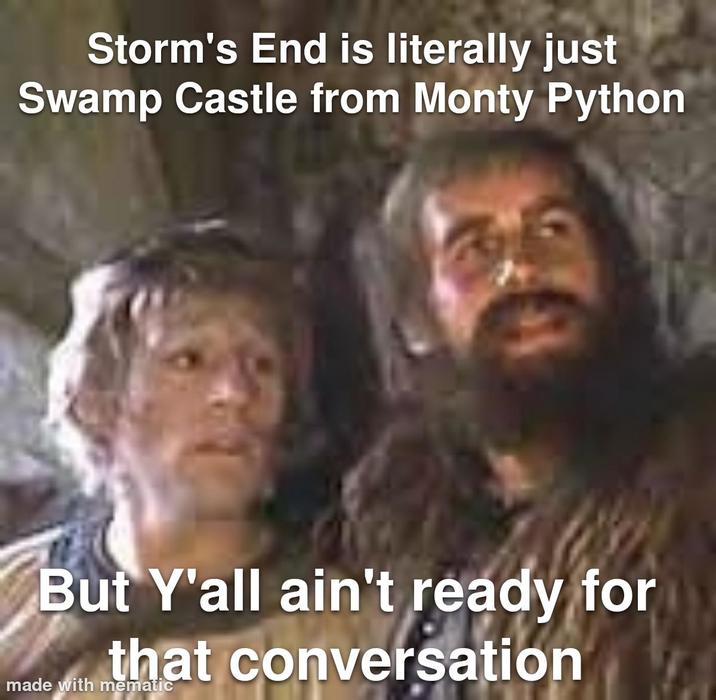
At what (x,y) coordinates should I click in order to perform the action: click on stone ceiling. Please return your answer as a coordinate pair (x, y). The image size is (716, 700). Looking at the image, I should click on (69, 185), (367, 126), (621, 157).